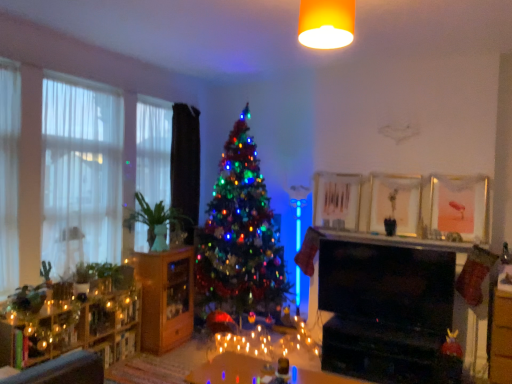
Question: Could shiny multicolored tree at center be considered to be inside yellow matte light fixture at upper center?

Choices:
 (A) yes
 (B) no

Answer: (B)

Question: From a real-world perspective, is yellow matte light fixture at upper center on shiny multicolored tree at center?

Choices:
 (A) no
 (B) yes

Answer: (B)

Question: From the image's perspective, is yellow matte light fixture at upper center over shiny multicolored tree at center?

Choices:
 (A) no
 (B) yes

Answer: (B)

Question: From a real-world perspective, is yellow matte light fixture at upper center positioned under shiny multicolored tree at center based on gravity?

Choices:
 (A) no
 (B) yes

Answer: (A)

Question: Is yellow matte light fixture at upper center closer to camera compared to shiny multicolored tree at center?

Choices:
 (A) yes
 (B) no

Answer: (A)

Question: Visually, is metallic gold picture frame at upper center, which ranks as the second picture frame in right-to-left order, positioned to the left or to the right of wooden cabinet at left, arranged as the 1th dresser when viewed from the back?

Choices:
 (A) left
 (B) right

Answer: (B)

Question: In the image, is metallic gold picture frame at upper center, which ranks as the second picture frame in right-to-left order, positioned in front of or behind wooden cabinet at left, the second dresser when ordered from front to back?

Choices:
 (A) front
 (B) behind

Answer: (A)

Question: From the image's perspective, relative to wooden cabinet at left, arranged as the 1th dresser when viewed from the back, is metallic gold picture frame at upper center, placed as the 1th picture frame when sorted from left to right, above or below?

Choices:
 (A) above
 (B) below

Answer: (A)

Question: Is point (399, 188) positioned closer to the camera than point (158, 304)?

Choices:
 (A) farther
 (B) closer

Answer: (A)

Question: In terms of width, does white sheer curtain at left, the 2th window positioned from the front, look wider or thinner when compared to pink matte picture frame at upper right, acting as the 2th picture frame starting from the left?

Choices:
 (A) wide
 (B) thin

Answer: (B)

Question: From a real-world perspective, relative to pink matte picture frame at upper right, placed as the first picture frame when sorted from right to left, is white sheer curtain at left, arranged as the first window when viewed from the back, vertically above or below?

Choices:
 (A) below
 (B) above

Answer: (B)

Question: Is white sheer curtain at left, arranged as the second window when viewed from the left, in front of or behind pink matte picture frame at upper right, placed as the first picture frame when sorted from right to left, in the image?

Choices:
 (A) front
 (B) behind

Answer: (B)

Question: From the image's perspective, is white sheer curtain at left, arranged as the first window when viewed from the back, positioned above or below pink matte picture frame at upper right, placed as the first picture frame when sorted from right to left?

Choices:
 (A) above
 (B) below

Answer: (A)

Question: From a real-world perspective, is green matte vase at left, which appears as the 2th plant when ordered from the bottom, above or below white sheer curtain at left, arranged as the 1th window when viewed from the right?

Choices:
 (A) above
 (B) below

Answer: (B)

Question: From the image's perspective, is green matte vase at left, which appears as the 2th plant when ordered from the bottom, above or below white sheer curtain at left, arranged as the first window when viewed from the back?

Choices:
 (A) below
 (B) above

Answer: (A)